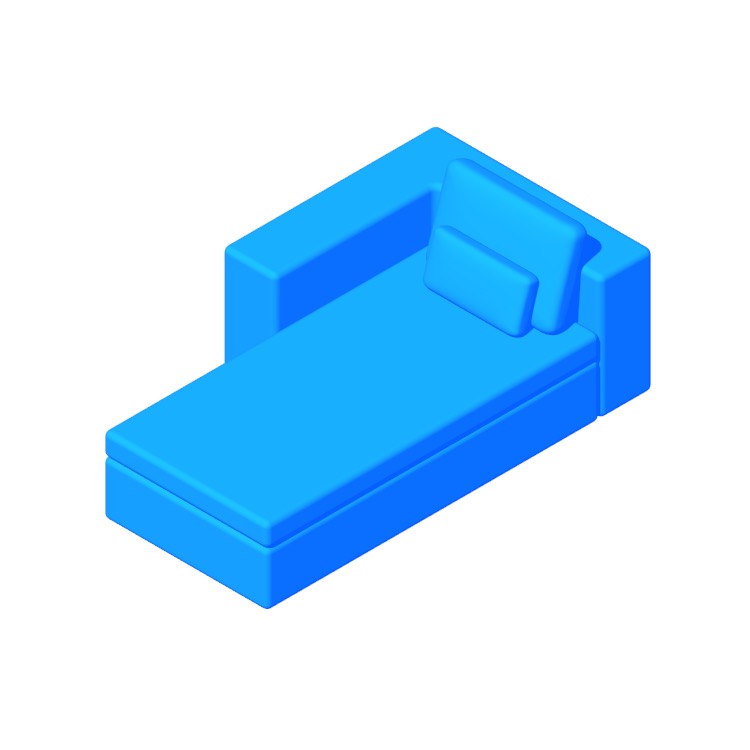
The image size is (750, 750). What are the coordinates of `side frame` in the screenshot? It's located at (429, 489).